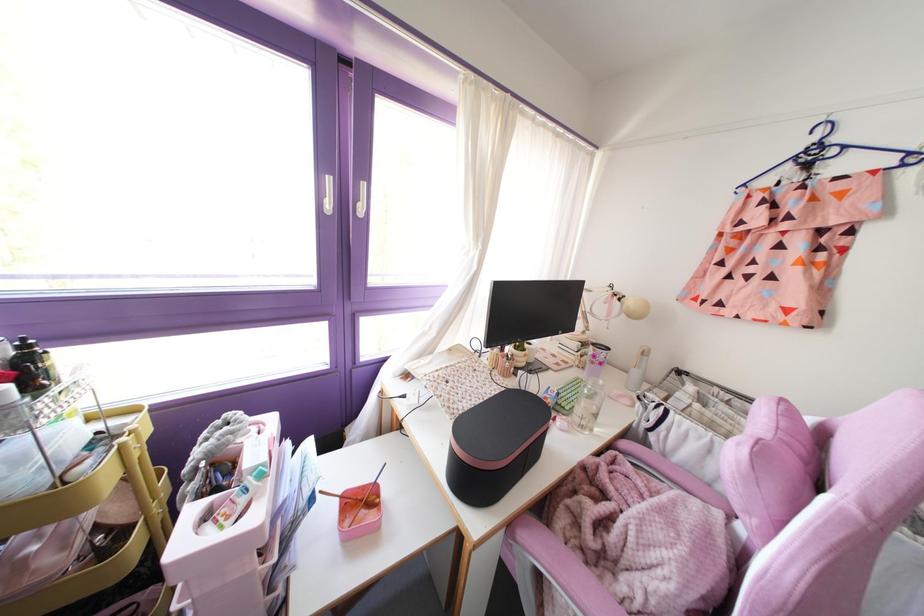
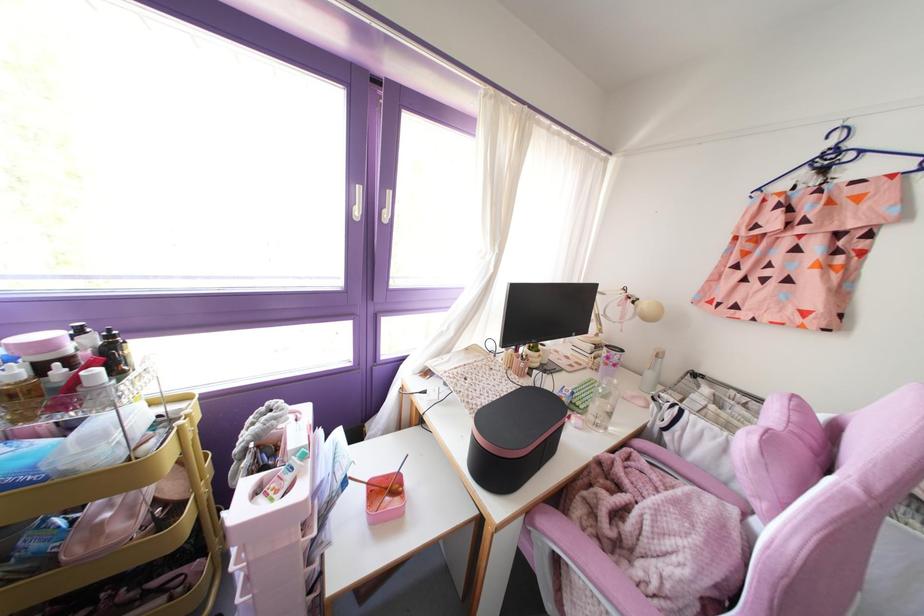
Find the pixel in the second image that matches point (601, 382) in the first image.

(614, 381)